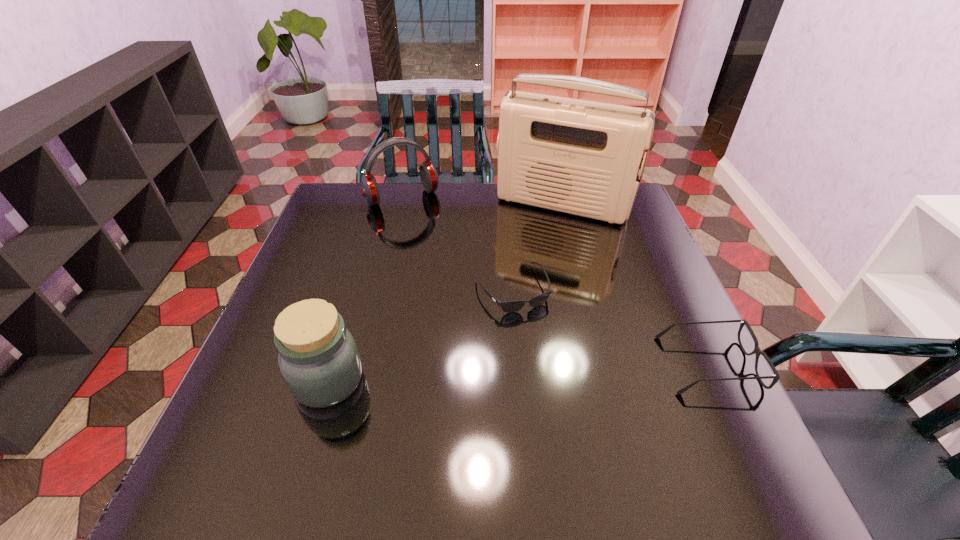
The image size is (960, 540). In order to click on vacant space that's between the radio receiver and the earphone in this screenshot , I will do `click(482, 201)`.

In order to click on vacant space in between the earphone and the spectacles in this screenshot , I will do `click(555, 281)`.

Where is `free space between the earphone and the spectacles`? The height and width of the screenshot is (540, 960). free space between the earphone and the spectacles is located at coordinates (555, 281).

The image size is (960, 540). Identify the location of empty space between the spectacles and the sunglasses. (610, 327).

The image size is (960, 540). Find the location of `object that ranks as the fourth closest to the earphone`. object that ranks as the fourth closest to the earphone is located at coordinates (757, 351).

At what (x,y) coordinates should I click in order to perform the action: click on object that ranks as the closest to the radio receiver. Please return your answer as a coordinate pair (x, y). This screenshot has height=540, width=960. Looking at the image, I should click on (510, 306).

Identify the location of vacant area that satisfies the following two spatial constraints: 1. on the front side of the earphone; 2. with the lenses facing outward on the second shortest object. (362, 364).

This screenshot has height=540, width=960. Find the location of `vacant point that satisfies the following two spatial constraints: 1. on the back side of the shortest object; 2. on the left side of the jar`. vacant point that satisfies the following two spatial constraints: 1. on the back side of the shortest object; 2. on the left side of the jar is located at coordinates (356, 289).

Locate an element on the screen. free space that satisfies the following two spatial constraints: 1. on the back side of the shortest object; 2. on the left side of the jar is located at coordinates (356, 289).

The height and width of the screenshot is (540, 960). What are the coordinates of `free location that satisfies the following two spatial constraints: 1. on the front side of the third farthest object; 2. with the lenses facing outward on the spectacles` in the screenshot? It's located at (517, 364).